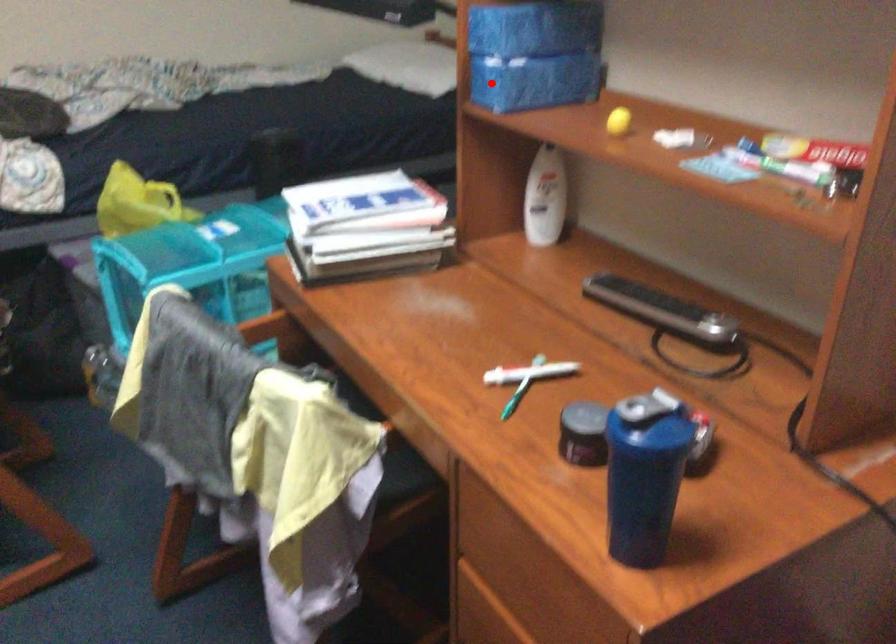
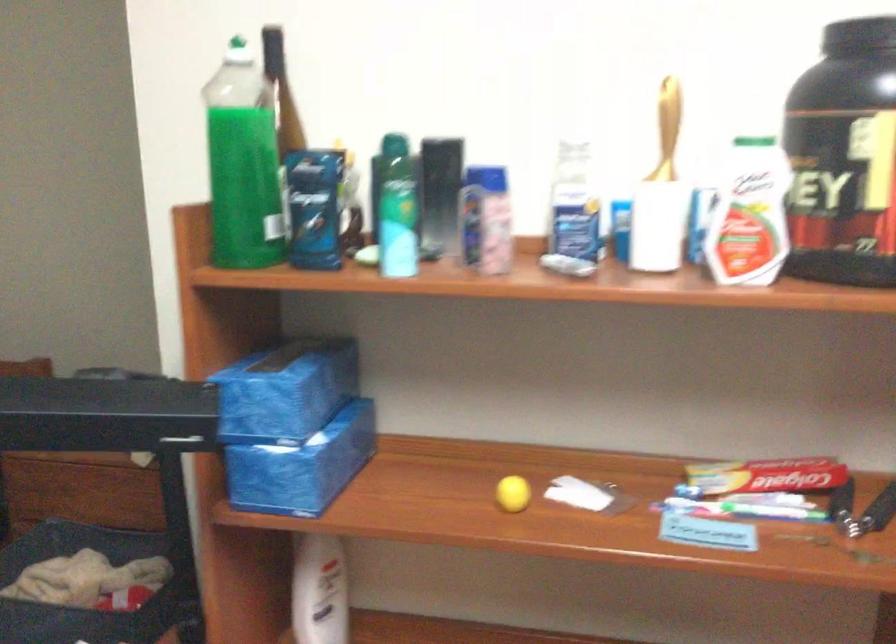
Locate, in the second image, the point that corresponds to the highlighted location in the first image.

(288, 478)